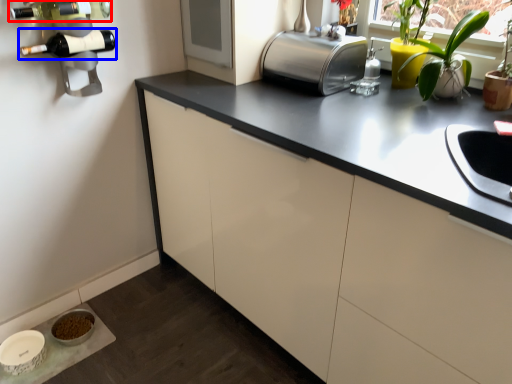
Question: Which object is closer to the camera taking this photo, wine bottle (highlighted by a red box) or wine bottle (highlighted by a blue box)?

Choices:
 (A) wine bottle
 (B) wine bottle

Answer: (A)